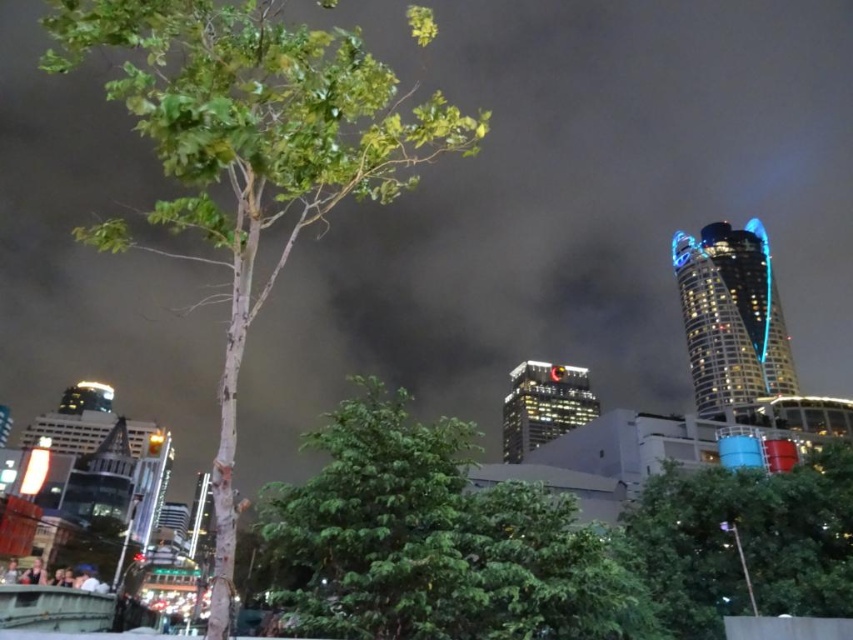
Question: Among these objects, which one is farthest from the camera?

Choices:
 (A) green leafy tree at center
 (B) green leafy tree at lower right

Answer: (B)

Question: Where is green leafy tree at center located in relation to green leafy tree at lower right in the image?

Choices:
 (A) left
 (B) right

Answer: (A)

Question: Does green leafy tree at center have a larger size compared to green leafy tree at lower right?

Choices:
 (A) yes
 (B) no

Answer: (A)

Question: Is green leafy tree at center positioned in front of green leafy tree at lower right?

Choices:
 (A) no
 (B) yes

Answer: (B)